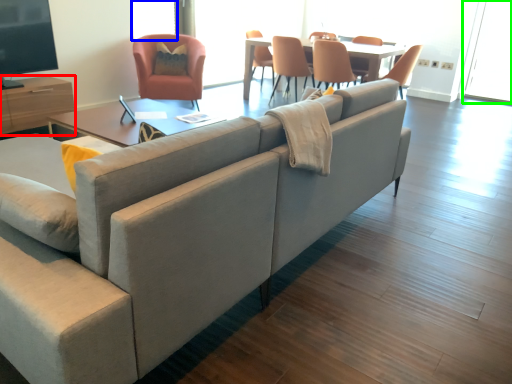
Question: Based on their relative distances, which object is nearer to entertainment center (highlighted by a red box)? Choose from window screen (highlighted by a blue box) and window screen (highlighted by a green box).

Choices:
 (A) window screen
 (B) window screen

Answer: (A)